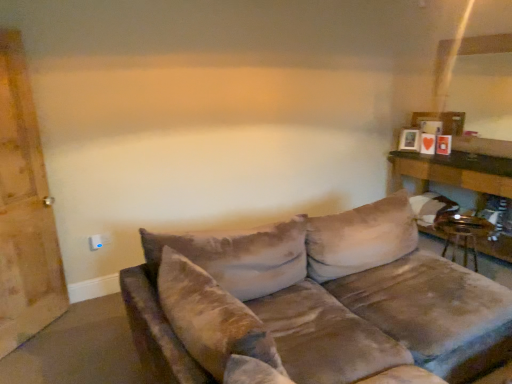
This screenshot has width=512, height=384. Identify the location of free location in front of matte wooden picture frame at upper right. (420, 153).